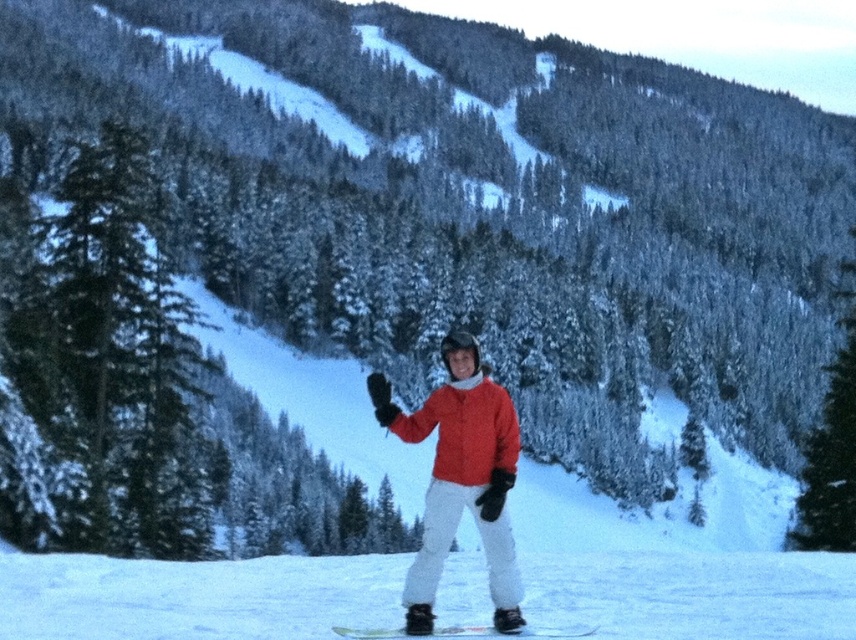
Does matte red jacket at center have a lesser width compared to green matte snowboard at center?

Correct, matte red jacket at center's width is less than green matte snowboard at center's.

Is matte red jacket at center to the left of green matte snowboard at center from the viewer's perspective?

Correct, you'll find matte red jacket at center to the left of green matte snowboard at center.

Locate an element on the screen. The width and height of the screenshot is (856, 640). matte red jacket at center is located at coordinates (461, 477).

Based on the photo, is green textured pine tree at left shorter than matte red jacket at center?

In fact, green textured pine tree at left may be taller than matte red jacket at center.

Is green textured pine tree at left taller than matte red jacket at center?

Correct, green textured pine tree at left is much taller as matte red jacket at center.

Image resolution: width=856 pixels, height=640 pixels. In order to click on green textured pine tree at left in this screenshot , I will do pos(111,362).

Can you confirm if green textured pine tree at left is wider than green matte snowboard at center?

Indeed, green textured pine tree at left has a greater width compared to green matte snowboard at center.

Can you confirm if green textured pine tree at left is positioned above green matte snowboard at center?

Yes, green textured pine tree at left is above green matte snowboard at center.

Between point (187, 528) and point (467, 625), which one is positioned in front?

Positioned in front is point (467, 625).

What are the coordinates of `green textured pine tree at left` in the screenshot? It's located at (111, 362).